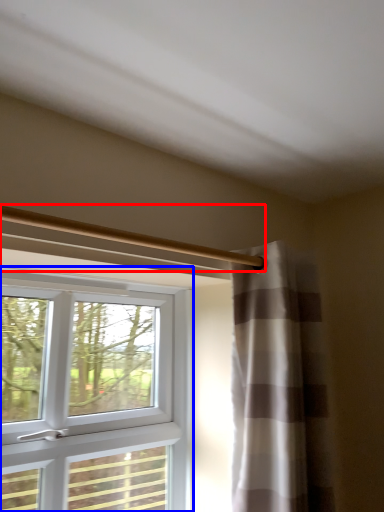
Question: Among these objects, which one is farthest to the camera, beam (highlighted by a red box) or window (highlighted by a blue box)?

Choices:
 (A) beam
 (B) window

Answer: (B)